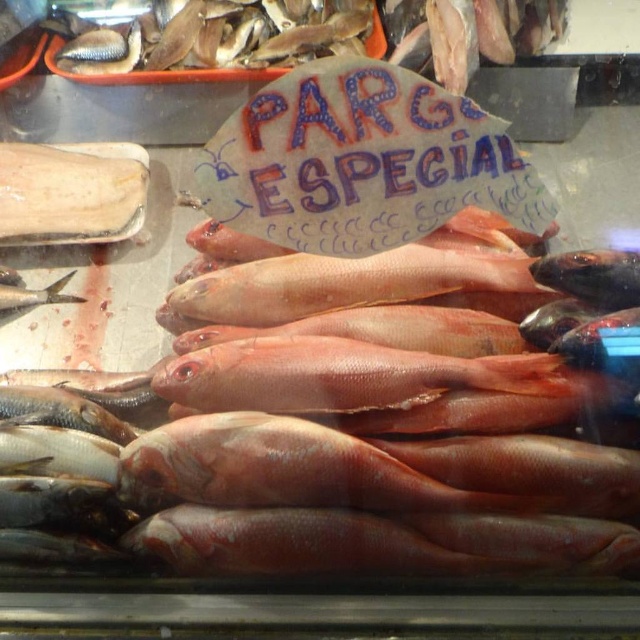
Can you confirm if shiny silver fish at upper left is shorter than shiny black fish at center?

Incorrect, shiny silver fish at upper left's height does not fall short of shiny black fish at center's.

Is shiny silver fish at upper left to the left of shiny black fish at center from the viewer's perspective?

Indeed, shiny silver fish at upper left is positioned on the left side of shiny black fish at center.

Identify the location of shiny silver fish at upper left. (250, 38).

How much distance is there between smooth white bone at upper left and shiny silver fish at center?

The distance of smooth white bone at upper left from shiny silver fish at center is 14.94 centimeters.

Between point (60, 163) and point (1, 298), which one is positioned behind?

Point (60, 163)

Between point (32, 216) and point (45, 291), which one is positioned behind?

Point (32, 216)

Image resolution: width=640 pixels, height=640 pixels. I want to click on smooth white bone at upper left, so click(x=70, y=193).

Can you confirm if shiny red fish at center is positioned to the right of shiny silver fish at center?

Indeed, shiny red fish at center is positioned on the right side of shiny silver fish at center.

Find the location of a particular element. The image size is (640, 640). shiny red fish at center is located at coordinates tap(355, 284).

Between point (468, 278) and point (35, 291), which one is positioned behind?

Point (35, 291)

Where is `shiny red fish at center`? The image size is (640, 640). shiny red fish at center is located at coordinates (355, 284).